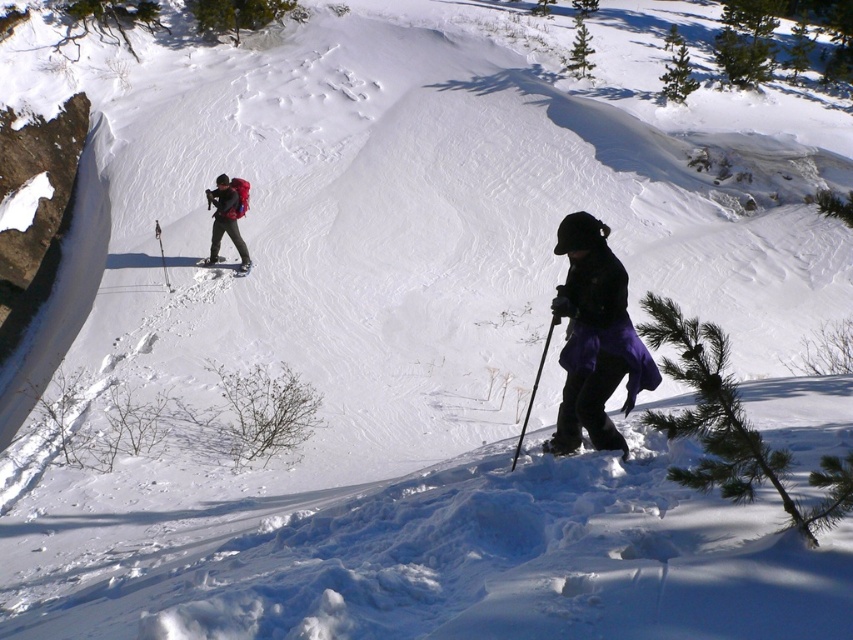
You are planning to take a photo of the purple fabric skirt at lower center while standing at the point marked by coordinates point (x=595, y=339). Will the purple fabric skirt at lower center be visible in your photo?

The point marked by coordinates point (x=595, y=339) indicates the location of the purple fabric skirt at lower center, so yes, the purple fabric skirt at lower center will be visible in your photo as you are standing at its location.

You are planning to take a photo of the purple fabric skirt at lower center and the matte red backpack at upper left in the snowy landscape. Which object should you focus on first if you want to capture both in a single frame without moving the camera?

The purple fabric skirt at lower center is much taller than the matte red backpack at upper left, so you should focus on the purple fabric skirt at lower center first to ensure it fits within the frame.

You are a photographer trying to capture both points in the image. Which point, point (x=585, y=388) or point (x=242, y=243), will appear larger in your photo?

Point (x=585, y=388) will appear larger in the photo because it is closer to the camera than point (x=242, y=243).